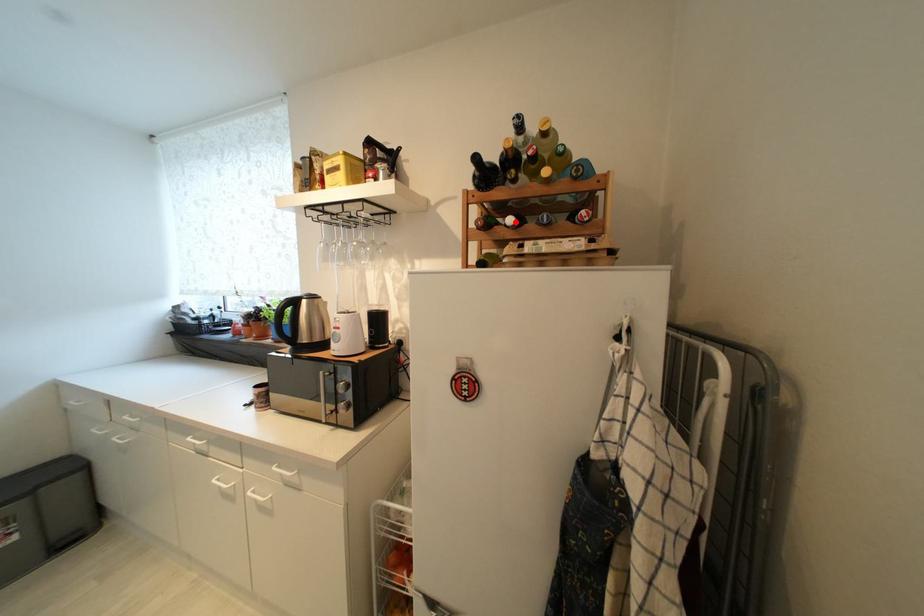
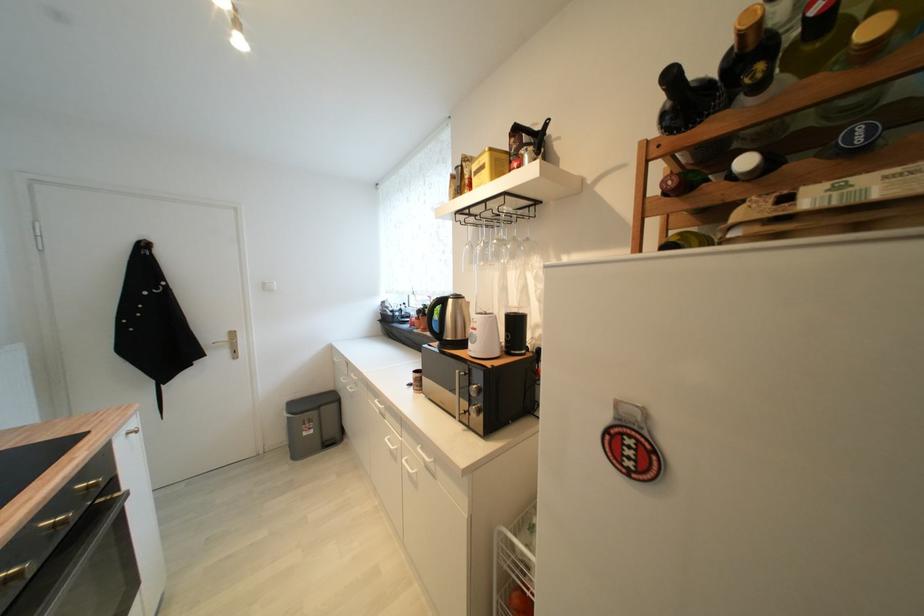
Question: I am providing you with two images of the same scene from different viewpoints. A red point is marked on the first image. Is the red point's position out of view in image 2?

Choices:
 (A) Yes
 (B) No

Answer: (B)